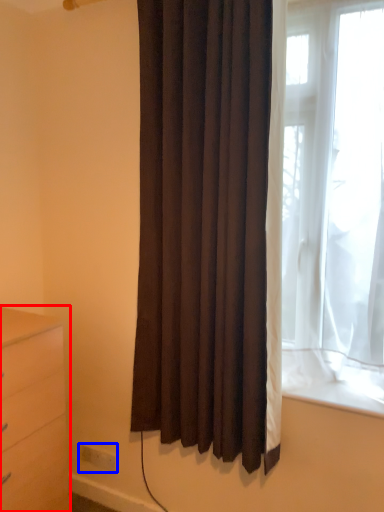
Question: Among these objects, which one is nearest to the camera, chest of drawers (highlighted by a red box) or electric outlet (highlighted by a blue box)?

Choices:
 (A) chest of drawers
 (B) electric outlet

Answer: (A)